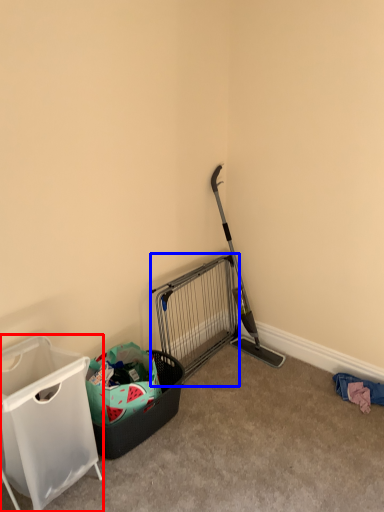
Question: Among these objects, which one is nearest to the camera, waste container (highlighted by a red box) or cage (highlighted by a blue box)?

Choices:
 (A) waste container
 (B) cage

Answer: (A)